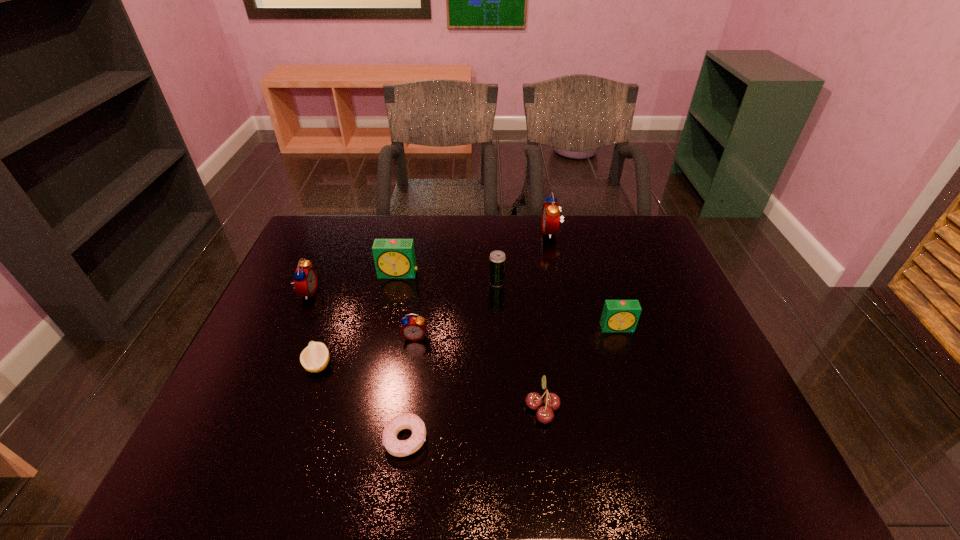
Find the location of a particular element. The width and height of the screenshot is (960, 540). free space located on the front-facing side of the farther green alarm clock is located at coordinates (384, 342).

The image size is (960, 540). What are the coordinates of `vacant region located on the back of the fourth object from right to left` in the screenshot? It's located at (494, 221).

At what (x,y) coordinates should I click in order to perform the action: click on vacant area located on the front-facing side of the smallest red alarm clock. Please return your answer as a coordinate pair (x, y). The image size is (960, 540). Looking at the image, I should click on click(397, 460).

Locate an element on the screen. free region located on the front-facing side of the nearer green alarm clock is located at coordinates click(646, 416).

This screenshot has height=540, width=960. Identify the location of blank space located 0.190m on the leaves of the seventh object from left to right. (443, 408).

Identify the location of vacant area situated on the leaves of the seventh object from left to right. (473, 408).

At what (x,y) coordinates should I click in order to perform the action: click on vacant space located on the leaves of the seventh object from left to right. Please return your answer as a coordinate pair (x, y). Image resolution: width=960 pixels, height=540 pixels. Looking at the image, I should click on (468, 408).

Locate an element on the screen. This screenshot has width=960, height=540. free space located on the left of the yellow lemon is located at coordinates (263, 365).

Locate an element on the screen. free space located 0.070m on the left of the white doughnut is located at coordinates (352, 439).

Identify the location of object present at the far edge. The image size is (960, 540). (551, 210).